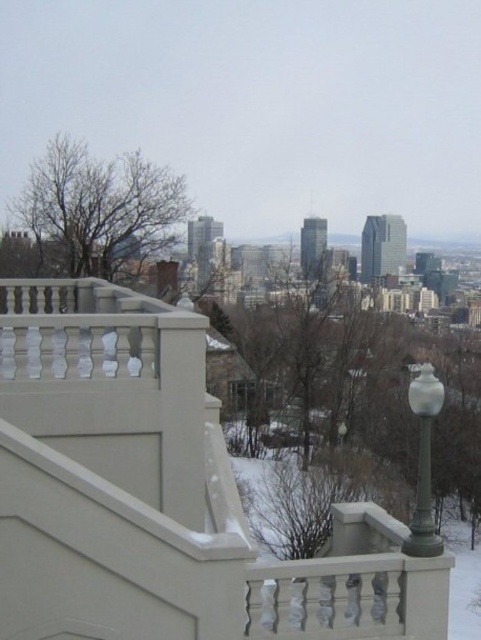
You are standing at the point labeled as point (161, 493) in the image. What is the immediate structure you are on?

The point (161, 493) corresponds to the white textured balcony at center.

You are standing on the white textured balcony at center and want to walk towards the white glass lamp post at right. Which direction should you move to reach it?

Since the white textured balcony at center is positioned on the left side of the white glass lamp post at right, you should move to your right to reach the lamp post.

You are standing on a balcony overlooking the city. You notice two points in the distance. The first point is at coordinates point [110,557] and the second is at point [415,512]. Which point is nearer to you?

Point [110,557] is closer to the viewer than point [415,512].